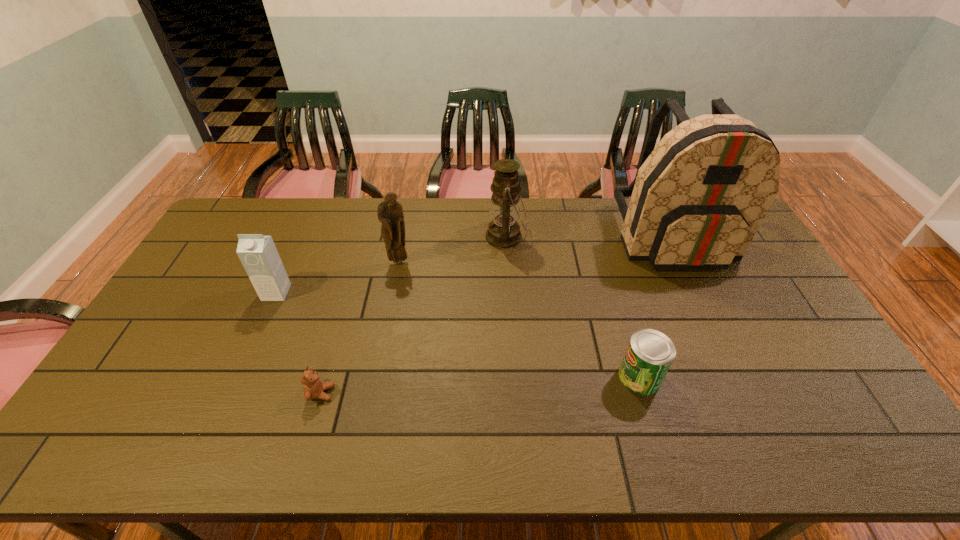
Where is `free spot located 0.080m on the front face of the backpack`? The height and width of the screenshot is (540, 960). free spot located 0.080m on the front face of the backpack is located at coordinates (699, 292).

Find the location of `free space located 0.320m on the front of the oil lamp`. free space located 0.320m on the front of the oil lamp is located at coordinates (512, 330).

You are a GUI agent. You are given a task and a screenshot of the screen. Output one action in this format:
    pyautogui.click(x=<x>, y=<y>)
    Task: Click on the vacant space located on the front-facing side of the third object from left to right
    The image size is (960, 540).
    Given the screenshot: What is the action you would take?
    pyautogui.click(x=396, y=277)

Find the location of a particular element. The image size is (960, 540). blank space located on the front label of the third nearest object is located at coordinates (253, 343).

Where is `vacant space situated on the right of the fifth tallest object`? This screenshot has height=540, width=960. vacant space situated on the right of the fifth tallest object is located at coordinates (728, 377).

Where is `vacant area located 0.070m on the face of the teddy bear`? The height and width of the screenshot is (540, 960). vacant area located 0.070m on the face of the teddy bear is located at coordinates (361, 393).

Find the location of a particular element. Image resolution: width=960 pixels, height=540 pixels. backpack positioned at the far edge is located at coordinates (697, 200).

Where is `oil lamp that is positioned at the far edge`? oil lamp that is positioned at the far edge is located at coordinates (503, 232).

The height and width of the screenshot is (540, 960). I want to click on object located in the right edge section of the desktop, so click(x=697, y=200).

This screenshot has height=540, width=960. What are the coordinates of `object that is at the far right corner` in the screenshot? It's located at (697, 200).